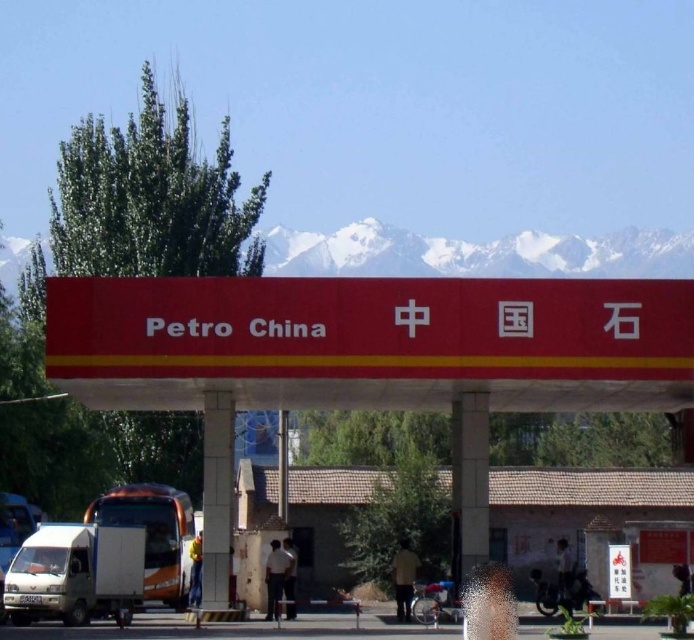
Question: Which of the following is the closest to the observer?

Choices:
 (A) (85, 515)
 (B) (3, 541)

Answer: (B)

Question: Is orange metallic truck at center positioned before white matte van at lower left?

Choices:
 (A) no
 (B) yes

Answer: (B)

Question: Which point is farther to the camera?

Choices:
 (A) orange metallic truck at center
 (B) white matte truck at lower left

Answer: (A)

Question: Can you confirm if red matte sign at center is positioned to the left of orange metallic truck at center?

Choices:
 (A) yes
 (B) no

Answer: (B)

Question: Is orange metallic truck at center positioned before white matte van at lower left?

Choices:
 (A) yes
 (B) no

Answer: (A)

Question: Which of these objects is positioned closest to the white matte van at lower left?

Choices:
 (A) red matte sign at center
 (B) orange metallic truck at center
 (C) white matte truck at lower left

Answer: (B)